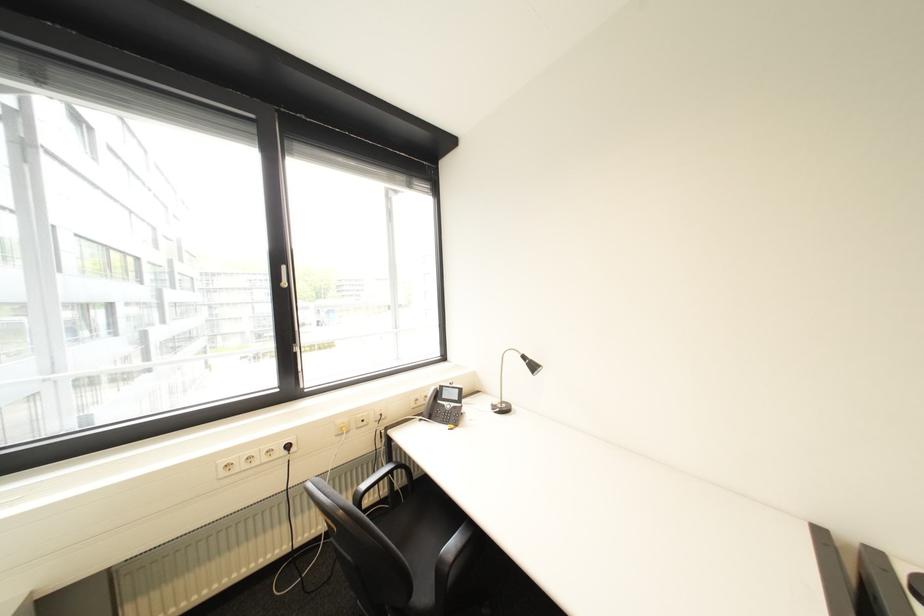
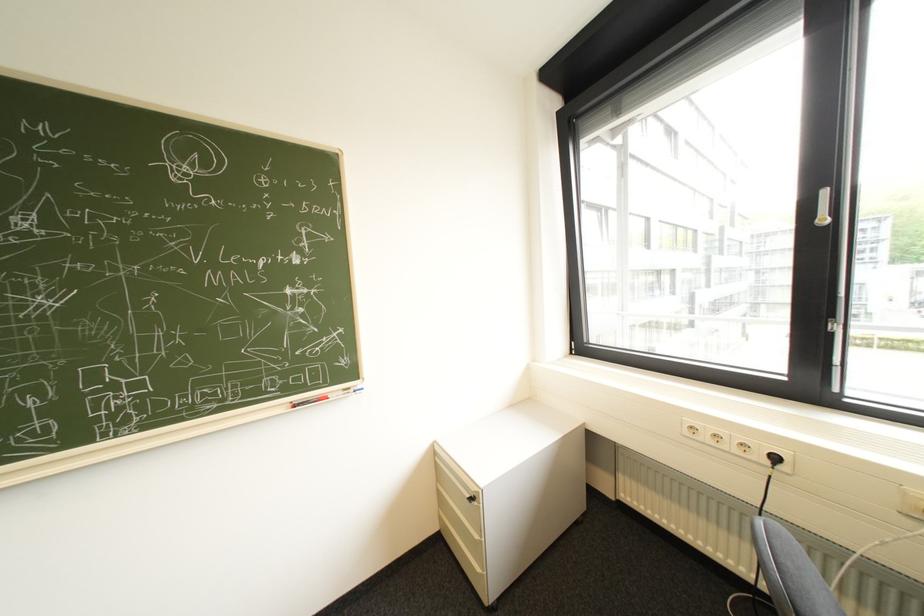
Where in the second image is the point corresponding to (x=295, y=453) from the first image?

(779, 463)